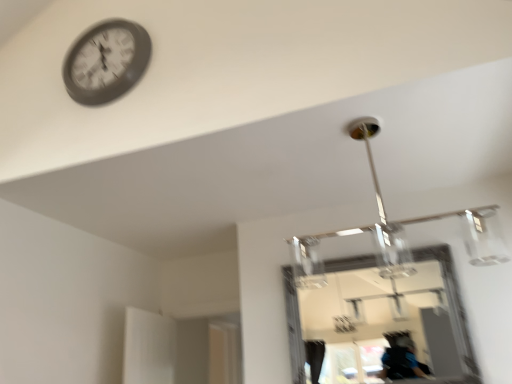
What do you see at coordinates (106, 62) in the screenshot? I see `matte black clock at upper left` at bounding box center [106, 62].

At what (x,y) coordinates should I click in order to perform the action: click on matte black clock at upper left. Please return your answer as a coordinate pair (x, y). Looking at the image, I should click on (106, 62).

The width and height of the screenshot is (512, 384). What do you see at coordinates (450, 293) in the screenshot?
I see `clear glass mirror at center` at bounding box center [450, 293].

Image resolution: width=512 pixels, height=384 pixels. I want to click on clear glass mirror at center, so click(450, 293).

Measure the distance between point (x=454, y=281) and camera.

A distance of 2.22 meters exists between point (x=454, y=281) and camera.

This screenshot has height=384, width=512. In order to click on matte black clock at upper left in this screenshot , I will do tap(106, 62).

Which object is positioned more to the right, clear glass mirror at center or matte black clock at upper left?

clear glass mirror at center is more to the right.

Is the depth of clear glass mirror at center greater than that of matte black clock at upper left?

Yes, the depth of clear glass mirror at center is greater than that of matte black clock at upper left.

Which point is more distant from viewer, (464, 350) or (86, 45)?

The point (464, 350) is farther.

From the image's perspective, between clear glass mirror at center and matte black clock at upper left, who is located below?

clear glass mirror at center is shown below in the image.

From a real-world perspective, which is physically below, clear glass mirror at center or matte black clock at upper left?

clear glass mirror at center is physically lower.

Between clear glass mirror at center and matte black clock at upper left, which one has larger width?

matte black clock at upper left is wider.

Does clear glass mirror at center have a greater height compared to matte black clock at upper left?

Indeed, clear glass mirror at center has a greater height compared to matte black clock at upper left.

Can you confirm if clear glass mirror at center is smaller than matte black clock at upper left?

No, clear glass mirror at center is not smaller than matte black clock at upper left.

Would you say clear glass mirror at center is outside matte black clock at upper left?

clear glass mirror at center is positioned outside matte black clock at upper left.

Are clear glass mirror at center and matte black clock at upper left far apart?

Yes, clear glass mirror at center and matte black clock at upper left are quite far apart.

Could you tell me if clear glass mirror at center is facing matte black clock at upper left?

No, clear glass mirror at center does not turn towards matte black clock at upper left.

How many degrees apart are the facing directions of clear glass mirror at center and matte black clock at upper left?

The angle between the facing direction of clear glass mirror at center and the facing direction of matte black clock at upper left is 0.304 degrees.

Where is `wall clock that appears above the clear glass mirror at center (from the image's perspective)`? This screenshot has width=512, height=384. wall clock that appears above the clear glass mirror at center (from the image's perspective) is located at coordinates (106, 62).

Between matte black clock at upper left and clear glass mirror at center, which one appears on the right side from the viewer's perspective?

From the viewer's perspective, clear glass mirror at center appears more on the right side.

Considering their positions, is matte black clock at upper left located in front of or behind clear glass mirror at center?

Visually, matte black clock at upper left is located in front of clear glass mirror at center.

Considering the positions of point (79, 68) and point (471, 355), is point (79, 68) closer or farther from the camera than point (471, 355)?

Point (79, 68) is closer to the camera than point (471, 355).

From the image's perspective, is matte black clock at upper left located above or below clear glass mirror at center?

Based on their image positions, matte black clock at upper left is located above clear glass mirror at center.

In the scene shown: From a real-world perspective, which is physically above, matte black clock at upper left or clear glass mirror at center?

From a 3D spatial view, matte black clock at upper left is above.

Which of these two, matte black clock at upper left or clear glass mirror at center, is wider?

matte black clock at upper left.

Between matte black clock at upper left and clear glass mirror at center, which one has more height?

clear glass mirror at center.

Considering the sizes of matte black clock at upper left and clear glass mirror at center in the image, is matte black clock at upper left bigger or smaller than clear glass mirror at center?

Considering their sizes, matte black clock at upper left takes up less space than clear glass mirror at center.

Is matte black clock at upper left situated inside clear glass mirror at center or outside?

matte black clock at upper left is located beyond the bounds of clear glass mirror at center.

Does matte black clock at upper left touch clear glass mirror at center?

No, matte black clock at upper left is not making contact with clear glass mirror at center.

Is matte black clock at upper left positioned with its back to clear glass mirror at center?

No.

You are a GUI agent. You are given a task and a screenshot of the screen. Output one action in this format:
    pyautogui.click(x=<x>, y=<y>)
    Task: Click on the wall clock above the clear glass mirror at center (from a real-world perspective)
    
    Given the screenshot: What is the action you would take?
    pyautogui.click(x=106, y=62)

This screenshot has height=384, width=512. Find the location of `mirror lying behind the matte black clock at upper left`. mirror lying behind the matte black clock at upper left is located at coordinates (450, 293).

This screenshot has width=512, height=384. What are the coordinates of `wall clock that is above the clear glass mirror at center (from the image's perspective)` in the screenshot? It's located at (106, 62).